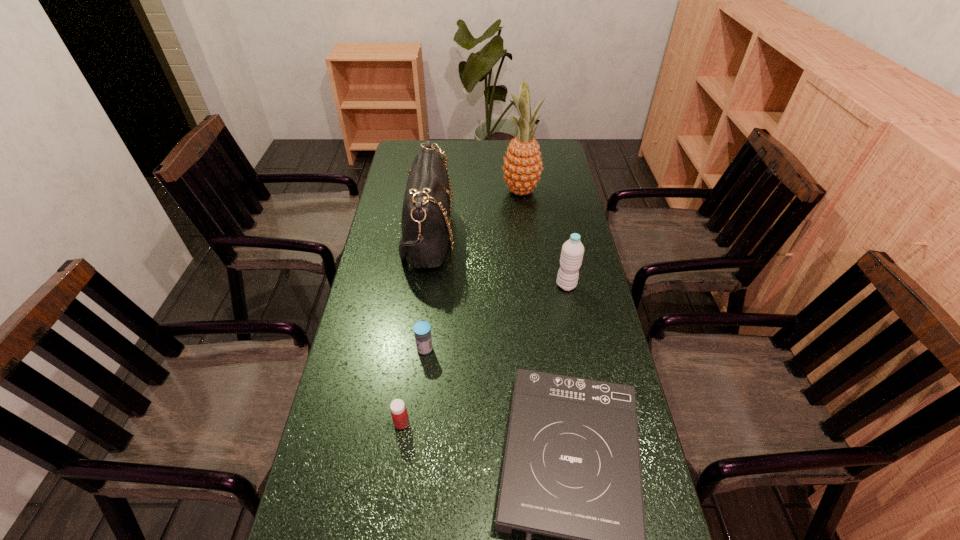
I want to click on handbag that is at the left edge, so click(425, 223).

Image resolution: width=960 pixels, height=540 pixels. What are the coordinates of `medicine located at the left edge` in the screenshot? It's located at (399, 414).

Locate an element on the screen. The width and height of the screenshot is (960, 540). pineapple that is at the right edge is located at coordinates (522, 168).

You are a GUI agent. You are given a task and a screenshot of the screen. Output one action in this format:
    pyautogui.click(x=<x>, y=<y>)
    Task: Click on the water bottle located in the right edge section of the desktop
    Image resolution: width=960 pixels, height=540 pixels.
    Given the screenshot: What is the action you would take?
    pyautogui.click(x=572, y=252)

Where is `vacant point at the far edge`? This screenshot has height=540, width=960. vacant point at the far edge is located at coordinates (472, 166).

At what (x,y) coordinates should I click in order to perform the action: click on free region at the left edge. Please return your answer as a coordinate pair (x, y). Looking at the image, I should click on (372, 264).

You are a GUI agent. You are given a task and a screenshot of the screen. Output one action in this format:
    pyautogui.click(x=<x>, y=<y>)
    Task: Click on the free space at the right edge of the desktop
    Image resolution: width=960 pixels, height=540 pixels.
    Given the screenshot: What is the action you would take?
    pyautogui.click(x=548, y=270)

What are the coordinates of `free space at the far left corner of the desktop` in the screenshot? It's located at (419, 148).

Where is `vacant area between the pineapple and the water bottle`? The height and width of the screenshot is (540, 960). vacant area between the pineapple and the water bottle is located at coordinates tap(543, 238).

At what (x,y) coordinates should I click in order to perform the action: click on free space between the pineapple and the water bottle. Please return your answer as a coordinate pair (x, y). The width and height of the screenshot is (960, 540). Looking at the image, I should click on (543, 238).